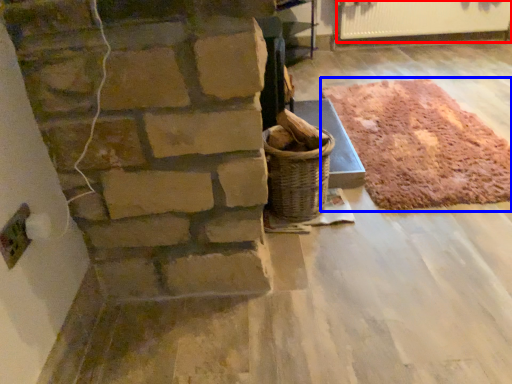
Question: Which object is further to the camera taking this photo, radiator (highlighted by a red box) or mat (highlighted by a blue box)?

Choices:
 (A) radiator
 (B) mat

Answer: (A)